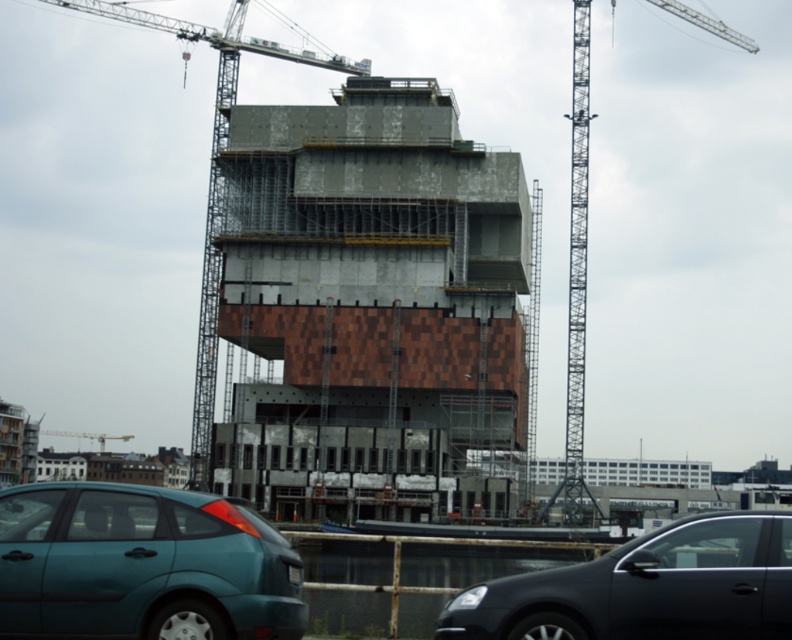
Question: Does concrete at center appear on the left side of teal matte hatchback at lower left?

Choices:
 (A) yes
 (B) no

Answer: (B)

Question: Which of the following is the closest to the observer?

Choices:
 (A) gray metallic crane at upper center
 (B) teal matte hatchback at lower left
 (C) metallic scaffolding at right
 (D) metallic gray crane at upper left

Answer: (B)

Question: Which point appears farthest from the camera in this image?

Choices:
 (A) (56, 433)
 (B) (490, 490)
 (C) (130, 497)
 (D) (170, 234)

Answer: (A)

Question: Can you confirm if shiny black sedan at lower right is positioned above metallic scaffolding at right?

Choices:
 (A) no
 (B) yes

Answer: (A)

Question: Does gray metallic crane at upper center come in front of metallic gray crane at upper left?

Choices:
 (A) no
 (B) yes

Answer: (B)

Question: Which point is closer to the camera taking this photo?

Choices:
 (A) (581, 496)
 (B) (242, 451)

Answer: (B)